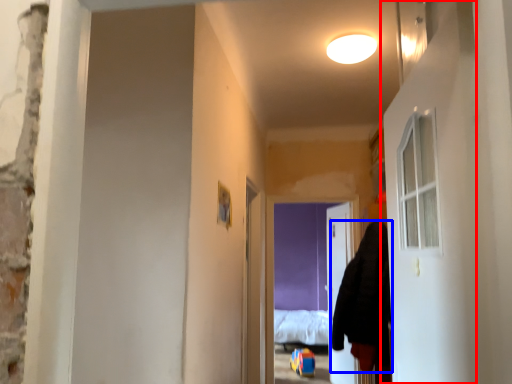
Question: Which point is further to the camera, door (highlighted by a red box) or hoodie (highlighted by a blue box)?

Choices:
 (A) door
 (B) hoodie

Answer: (B)